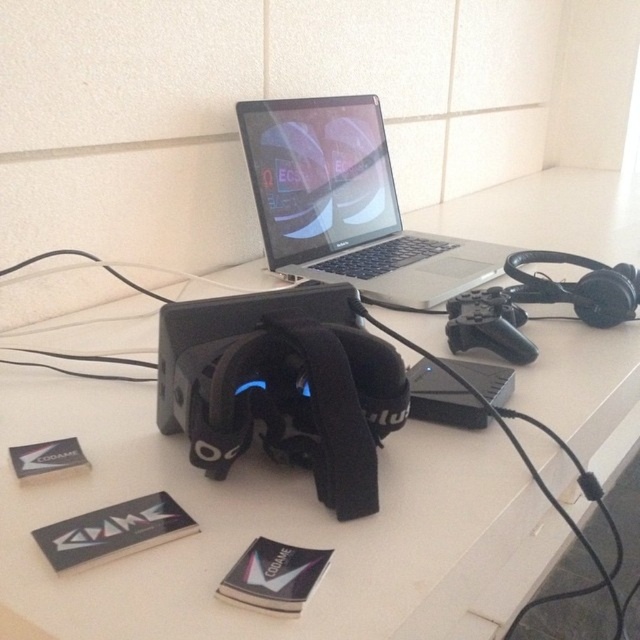
Question: In this image, where is white matte computer desk at center located relative to silver metallic laptop at center?

Choices:
 (A) right
 (B) left

Answer: (A)

Question: Observing the image, what is the correct spatial positioning of white matte computer desk at center in reference to silver metallic laptop at center?

Choices:
 (A) left
 (B) right

Answer: (B)

Question: Is white matte computer desk at center thinner than silver metallic laptop at center?

Choices:
 (A) no
 (B) yes

Answer: (A)

Question: Among these objects, which one is nearest to the camera?

Choices:
 (A) silver metallic laptop at center
 (B) white matte computer desk at center

Answer: (B)

Question: Which object appears closest to the camera in this image?

Choices:
 (A) white matte computer desk at center
 (B) silver metallic laptop at center

Answer: (A)